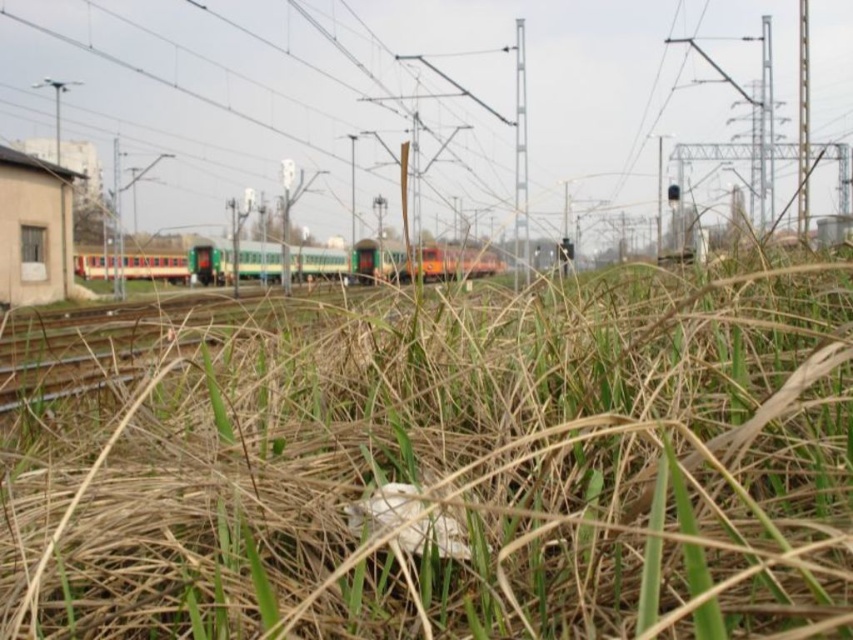
Is dry grass at center positioned before green matte train at center?

That is True.

Find the location of a particular element. The height and width of the screenshot is (640, 853). dry grass at center is located at coordinates (445, 464).